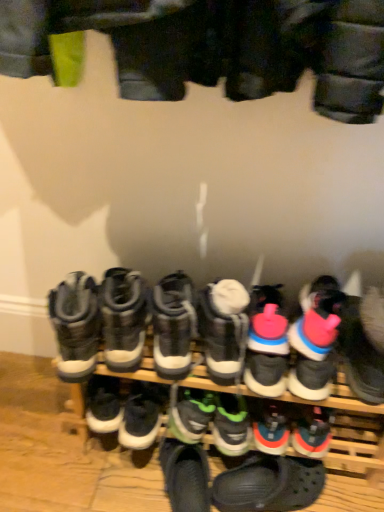
Question: From the image's perspective, is pink rubber sneaker at right, the 12th footwear in the left-to-right sequence, over green rubber sneaker at center, which appears as the fifth footwear when viewed from the right?

Choices:
 (A) yes
 (B) no

Answer: (A)

Question: Is green rubber sneaker at center, which appears as the fifth footwear when viewed from the right, completely or partially inside pink rubber sneaker at right, the 12th footwear in the left-to-right sequence?

Choices:
 (A) no
 (B) yes

Answer: (A)

Question: From a real-world perspective, is pink rubber sneaker at right, which appears as the 1th footwear when viewed from the right, positioned over green rubber sneaker at center, which is the eighth footwear in left-to-right order, based on gravity?

Choices:
 (A) no
 (B) yes

Answer: (B)

Question: Does pink rubber sneaker at right, which appears as the 1th footwear when viewed from the right, have a lesser height compared to green rubber sneaker at center, which is the eighth footwear in left-to-right order?

Choices:
 (A) no
 (B) yes

Answer: (A)

Question: Is pink rubber sneaker at right, which appears as the 1th footwear when viewed from the right, oriented away from green rubber sneaker at center, which is the eighth footwear in left-to-right order?

Choices:
 (A) no
 (B) yes

Answer: (A)

Question: Is white rubber boots at center, which ranks as the eleventh footwear in right-to-left order, situated inside black rubber clogs at lower center, which is the 10th footwear from left to right, or outside?

Choices:
 (A) inside
 (B) outside

Answer: (B)

Question: Relative to black rubber clogs at lower center, positioned as the third footwear in right-to-left order, is white rubber boots at center, the second footwear viewed from the left, in front or behind?

Choices:
 (A) behind
 (B) front

Answer: (B)

Question: Considering the positions of point (109, 283) and point (292, 503), is point (109, 283) closer or farther from the camera than point (292, 503)?

Choices:
 (A) closer
 (B) farther

Answer: (A)

Question: Considering the positions of white rubber boots at center, the second footwear viewed from the left, and black rubber clogs at lower center, positioned as the third footwear in right-to-left order, in the image, is white rubber boots at center, the second footwear viewed from the left, taller or shorter than black rubber clogs at lower center, positioned as the third footwear in right-to-left order,?

Choices:
 (A) tall
 (B) short

Answer: (A)

Question: Is black rubber clogs at lower center, positioned as the third footwear in right-to-left order, in front of or behind white rubber boots at center, the second footwear viewed from the left, in the image?

Choices:
 (A) behind
 (B) front

Answer: (A)

Question: From the image's perspective, is black rubber clogs at lower center, positioned as the third footwear in right-to-left order, positioned above or below white rubber boots at center, the second footwear viewed from the left?

Choices:
 (A) below
 (B) above

Answer: (A)

Question: From their relative heights in the image, would you say black rubber clogs at lower center, which is the 10th footwear from left to right, is taller or shorter than white rubber boots at center, the second footwear viewed from the left?

Choices:
 (A) tall
 (B) short

Answer: (B)

Question: In terms of size, does black rubber clogs at lower center, positioned as the third footwear in right-to-left order, appear bigger or smaller than white rubber boots at center, the second footwear viewed from the left?

Choices:
 (A) big
 (B) small

Answer: (A)

Question: Considering the positions of point (173, 419) and point (57, 352), is point (173, 419) closer or farther from the camera than point (57, 352)?

Choices:
 (A) farther
 (B) closer

Answer: (A)

Question: Is green matte sneakers at center, the 5th footwear in the left-to-right sequence, taller or shorter than gray suede boots at left, which ranks as the twelfth footwear in right-to-left order?

Choices:
 (A) tall
 (B) short

Answer: (B)